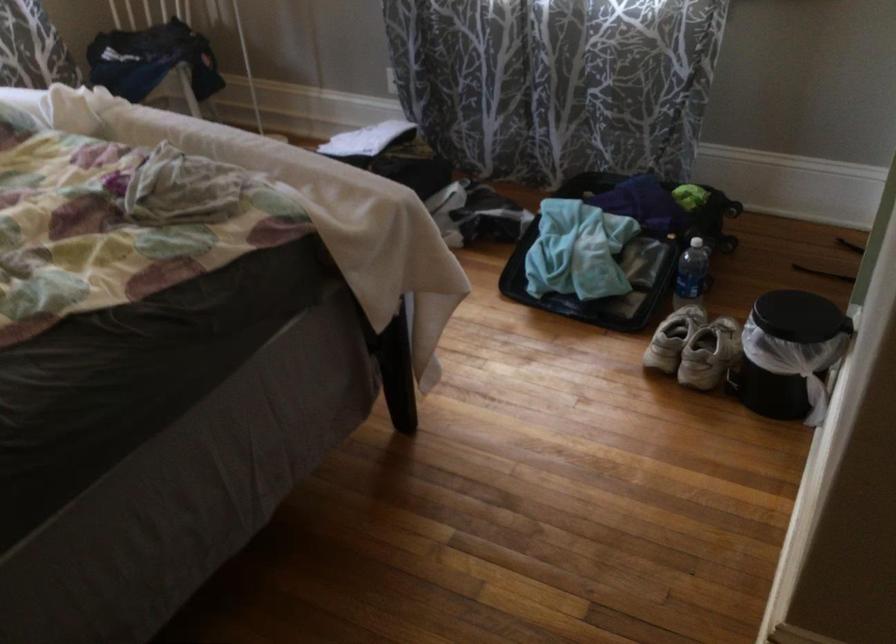
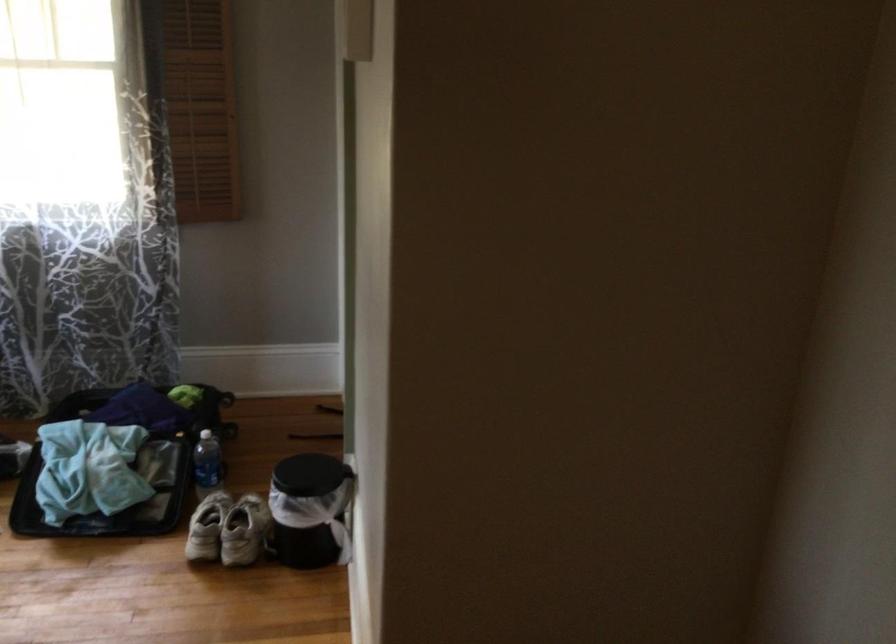
Where in the second image is the point corresponding to the point at 590,276 from the first image?

(110, 491)